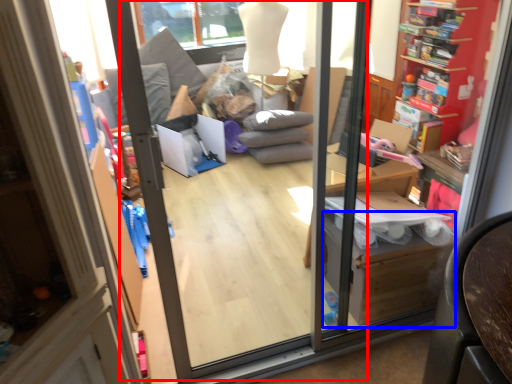
Question: Which object is closer to the camera taking this photo, screen door (highlighted by a red box) or cardboard box (highlighted by a blue box)?

Choices:
 (A) screen door
 (B) cardboard box

Answer: (A)